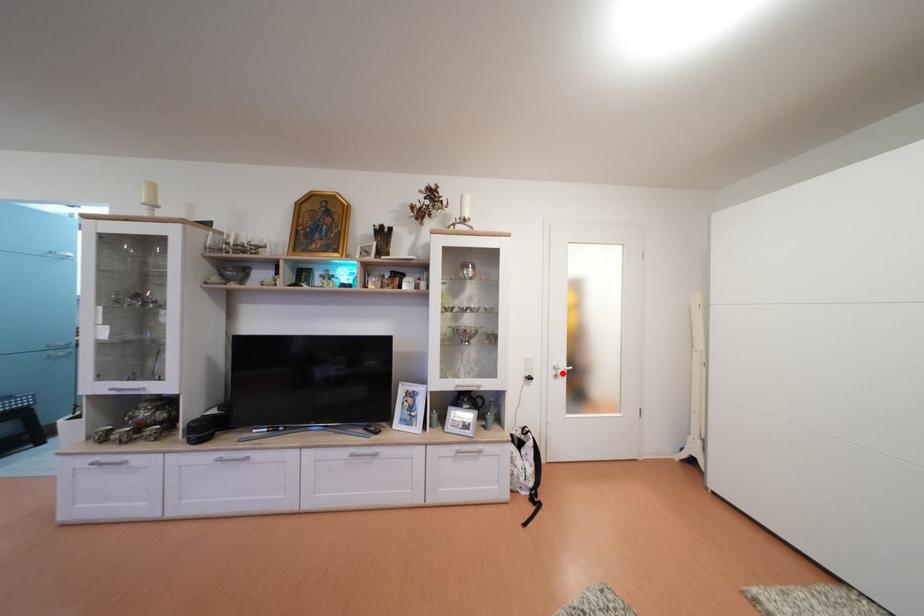
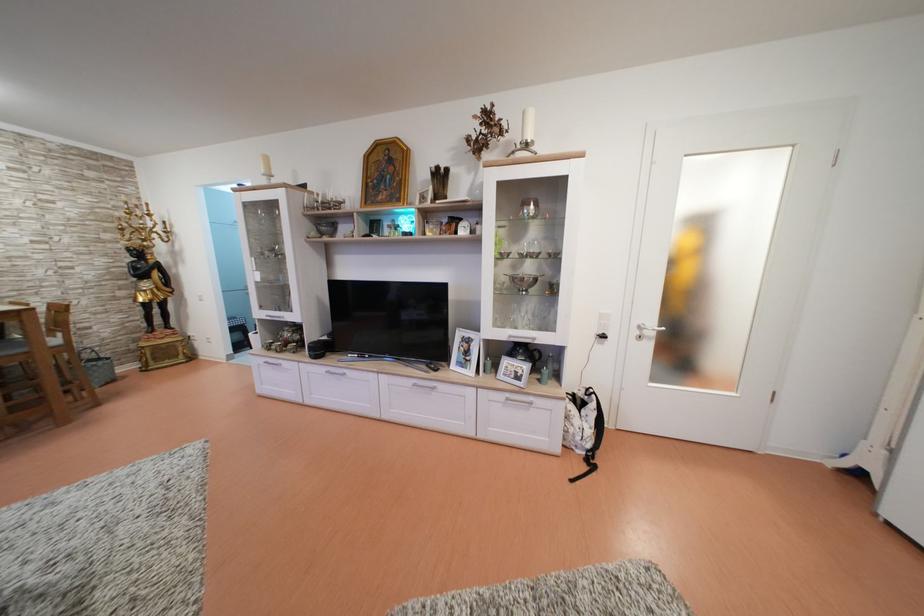
The point at the highlighted location is marked in the first image. Where is the corresponding point in the second image?

(647, 333)